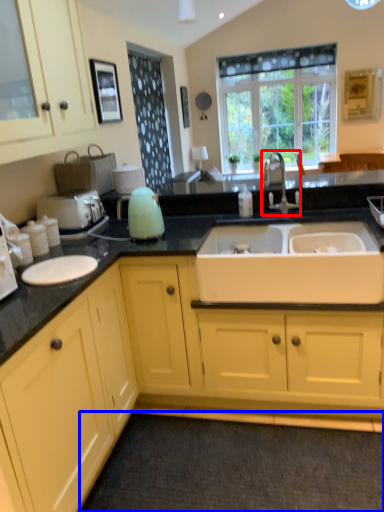
Question: Which of the following is the farthest to the observer, tap (highlighted by a red box) or plain (highlighted by a blue box)?

Choices:
 (A) tap
 (B) plain

Answer: (A)